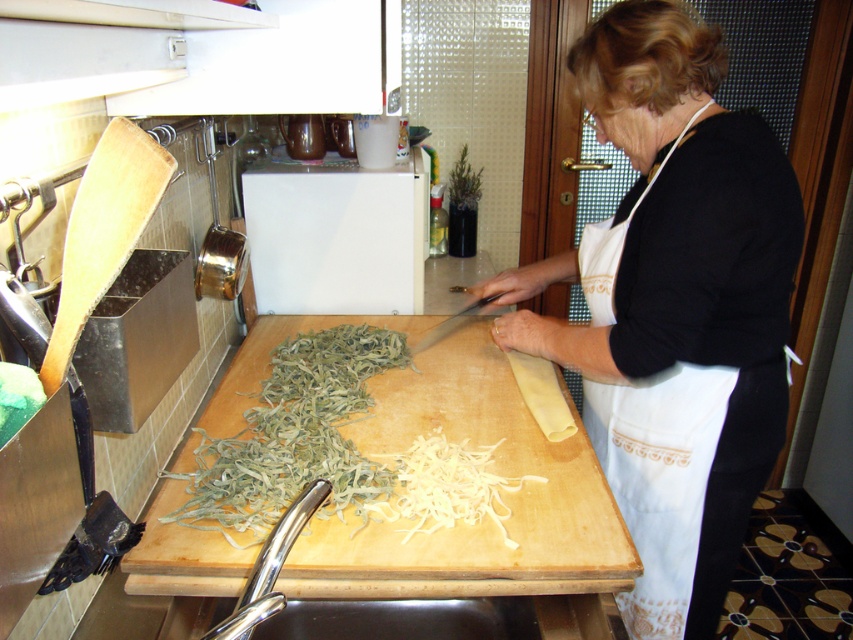
Question: Does white apron at center come in front of wooden cutting board at center?

Choices:
 (A) no
 (B) yes

Answer: (B)

Question: Among these objects, which one is farthest from the camera?

Choices:
 (A) white noodle at center
 (B) white apron at center
 (C) wooden cutting board at center

Answer: (A)

Question: Which point appears farthest from the camera in this image?

Choices:
 (A) (466, 435)
 (B) (654, 445)
 (C) (567, 58)
 (D) (451, 497)

Answer: (A)

Question: Estimate the real-world distances between objects in this image. Which object is closer to the white noodle at center?

Choices:
 (A) white cotton apron at center
 (B) white apron at center
 (C) wooden cutting board at center

Answer: (C)

Question: Is wooden cutting board at center closer to camera compared to white cotton apron at center?

Choices:
 (A) no
 (B) yes

Answer: (B)

Question: Does white apron at center have a lesser width compared to white cotton apron at center?

Choices:
 (A) yes
 (B) no

Answer: (B)